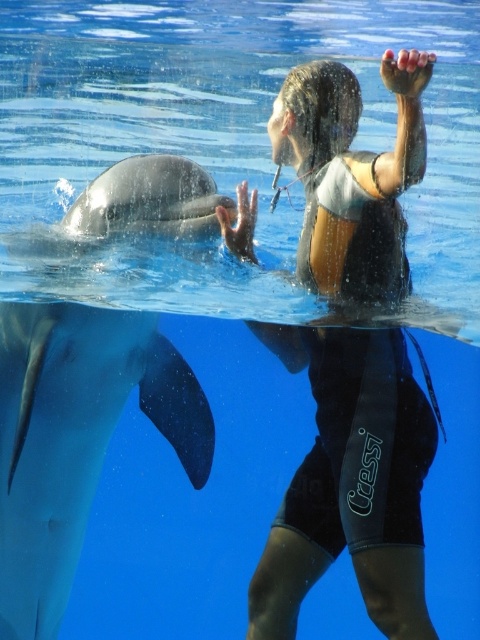
Looking at this image, who is lower down, smooth gray dolphin at left or gray smooth dolphin at left?

smooth gray dolphin at left is lower down.

Is smooth gray dolphin at left below gray smooth dolphin at left?

Indeed, smooth gray dolphin at left is positioned under gray smooth dolphin at left.

Is point (7, 534) behind point (79, 214)?

Yes, it is behind point (79, 214).

Where is `smooth gray dolphin at left`? This screenshot has width=480, height=640. smooth gray dolphin at left is located at coordinates (75, 438).

Identify the location of black neoprene wetsuit at upper center. This screenshot has width=480, height=640. (350, 483).

Does black neoprene wetsuit at upper center have a lesser width compared to smooth gray dolphin at left?

Yes, black neoprene wetsuit at upper center is thinner than smooth gray dolphin at left.

Which is behind, point (367, 460) or point (0, 508)?

The point (0, 508) is behind.

Locate an element on the screen. black neoprene wetsuit at upper center is located at coordinates (350, 483).

Locate an element on the screen. The height and width of the screenshot is (640, 480). black neoprene wetsuit at upper center is located at coordinates (350, 483).

Is black neoprene wetsuit at upper center positioned before gray smooth dolphin at left?

Yes, it is in front of gray smooth dolphin at left.

Locate an element on the screen. This screenshot has height=640, width=480. black neoprene wetsuit at upper center is located at coordinates (350, 483).